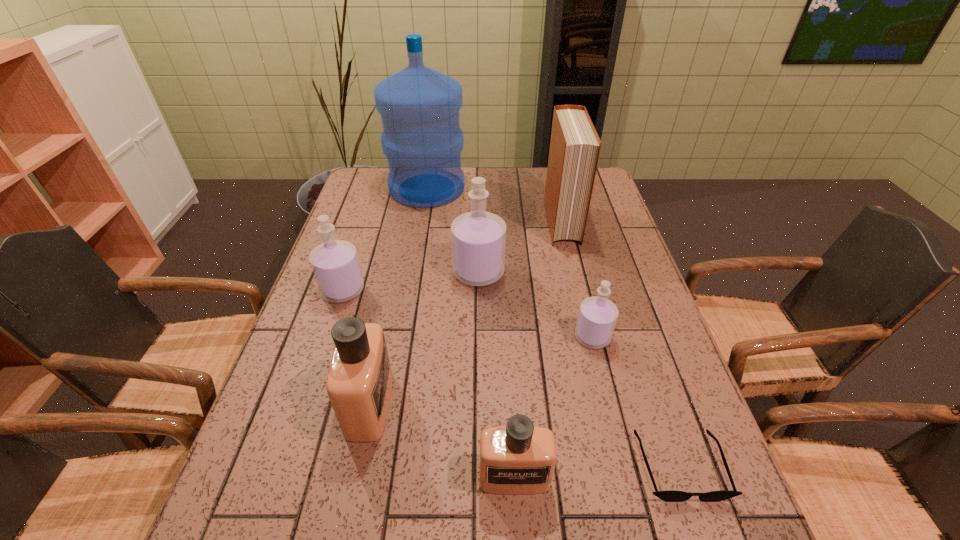
Find the location of a particular element. Image resolution: width=960 pixels, height=540 pixels. vacant region that satisfies the following two spatial constraints: 1. on the open cover of the hardback book; 2. on the right side of the smallest purple perfume is located at coordinates (588, 337).

At what (x,y) coordinates should I click in order to perform the action: click on free region that satisfies the following two spatial constraints: 1. on the front side of the biggest purple perfume; 2. on the front label of the left beige perfume. Please return your answer as a coordinate pair (x, y). The height and width of the screenshot is (540, 960). Looking at the image, I should click on (478, 404).

What are the coordinates of `vacant area in the image that satisfies the following two spatial constraints: 1. on the open cover of the smallest purple perfume; 2. on the left side of the hardback book` in the screenshot? It's located at tap(588, 337).